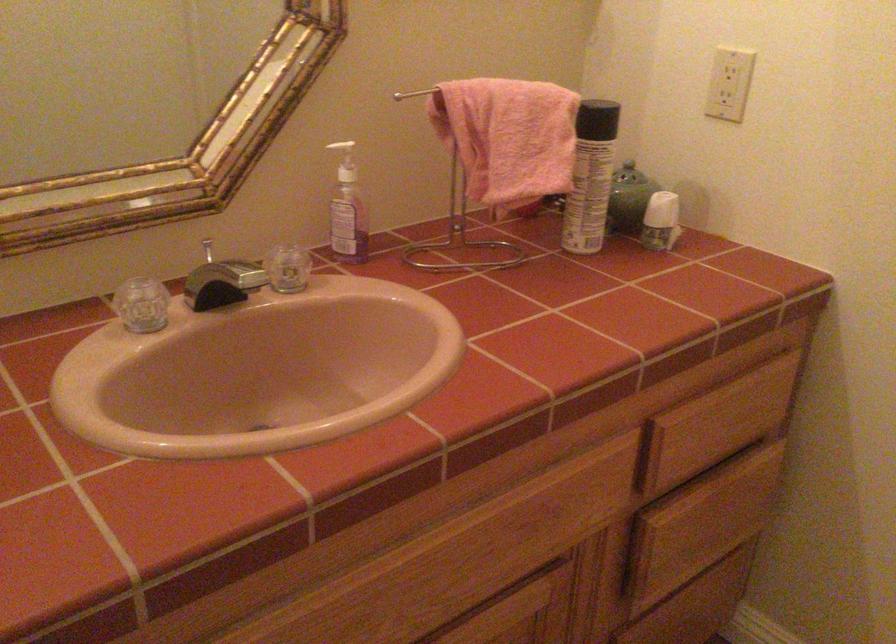
Image resolution: width=896 pixels, height=644 pixels. What do you see at coordinates (348, 210) in the screenshot? I see `the aerosol can nozzle` at bounding box center [348, 210].